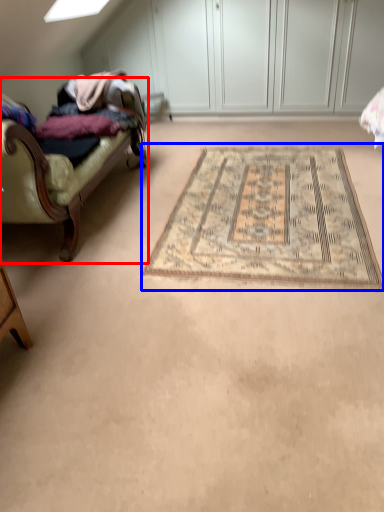
Question: Which object appears closest to the camera in this image, studio couch (highlighted by a red box) or mat (highlighted by a blue box)?

Choices:
 (A) studio couch
 (B) mat

Answer: (A)